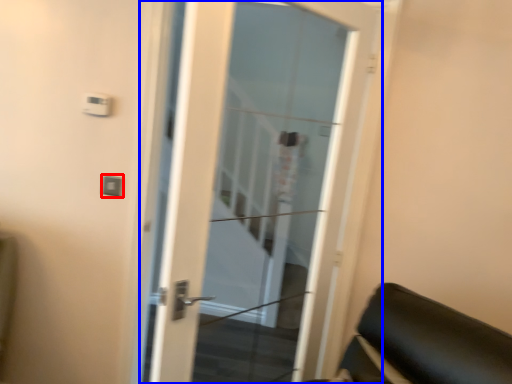
Question: Among these objects, which one is nearest to the camera, light switch (highlighted by a red box) or door (highlighted by a blue box)?

Choices:
 (A) light switch
 (B) door

Answer: (B)